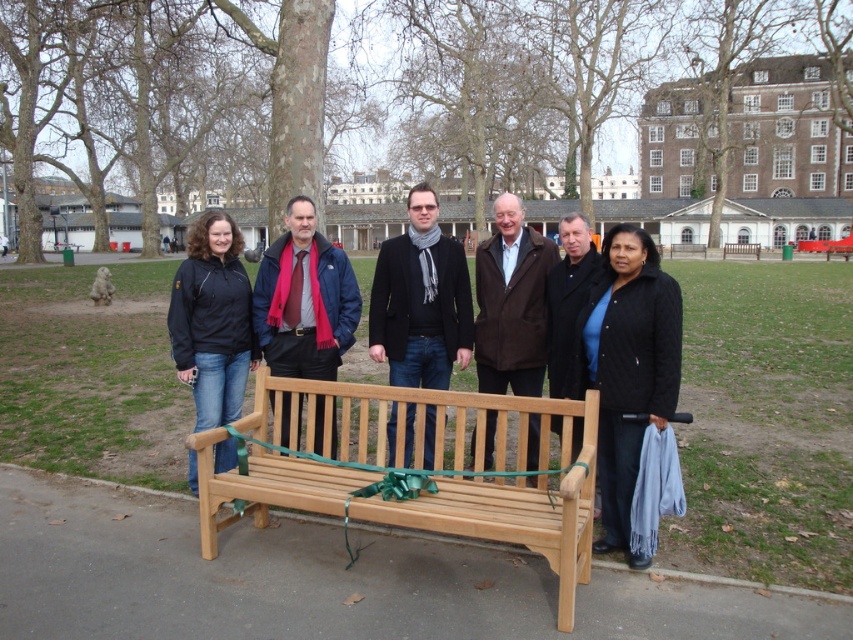
Can you confirm if black quilted jacket at center is wider than black matte jacket at left?

Incorrect, black quilted jacket at center's width does not surpass black matte jacket at left's.

Locate an element on the screen. This screenshot has height=640, width=853. black quilted jacket at center is located at coordinates (627, 369).

Does point (666, 298) come in front of point (231, 280)?

Yes, it is.

Identify the location of black quilted jacket at center. (627, 369).

Is point (605, 516) positioned in front of point (737, 252)?

Yes, it is in front of point (737, 252).

Is black quilted jacket at center in front of wooden bench at center?

Yes, black quilted jacket at center is closer to the viewer.

Where is `black quilted jacket at center`? black quilted jacket at center is located at coordinates (627, 369).

Where is `black quilted jacket at center`? The image size is (853, 640). black quilted jacket at center is located at coordinates [627, 369].

Which is more to the right, natural wood bench at center or brown leather jacket at center?

Positioned to the right is brown leather jacket at center.

Between point (590, 502) and point (535, 480), which one is positioned behind?

Point (535, 480)

Which is in front, point (541, 518) or point (544, 280)?

Point (541, 518) is more forward.

Where is `natural wood bench at center`? This screenshot has height=640, width=853. natural wood bench at center is located at coordinates (415, 467).